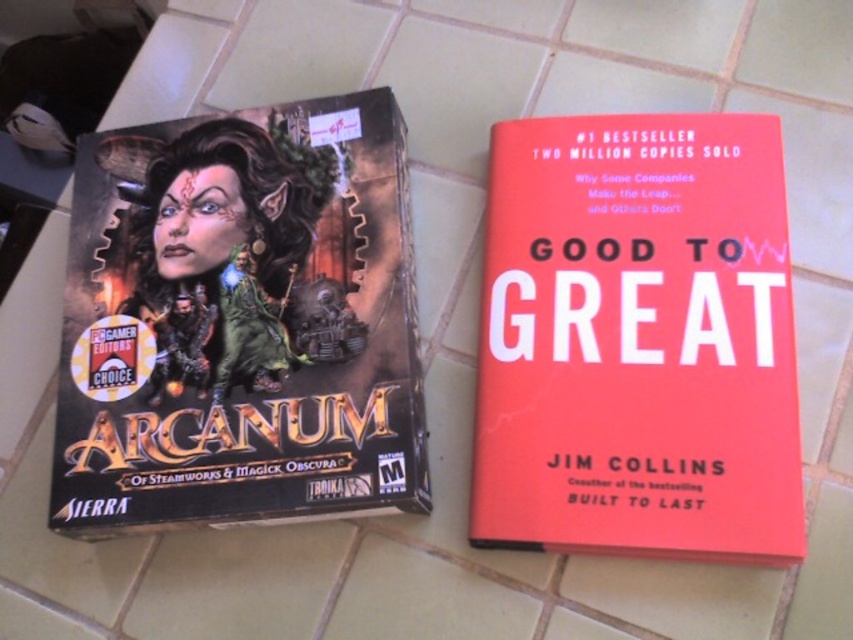
Question: In this image, where is hardcover book at center located relative to red matte hardcover book at center?

Choices:
 (A) above
 (B) below

Answer: (A)

Question: Among these objects, which one is nearest to the camera?

Choices:
 (A) hardcover book at center
 (B) red matte hardcover book at center

Answer: (B)

Question: Can you confirm if hardcover book at center is smaller than red matte hardcover book at center?

Choices:
 (A) no
 (B) yes

Answer: (A)

Question: Which point is farther to the camera?

Choices:
 (A) hardcover book at center
 (B) red matte hardcover book at center

Answer: (A)

Question: Is hardcover book at center bigger than red matte hardcover book at center?

Choices:
 (A) yes
 (B) no

Answer: (A)